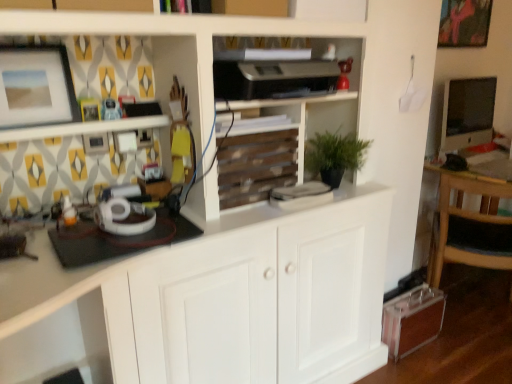
I want to click on free region under wooden chair at right (from a real-world perspective), so click(x=474, y=319).